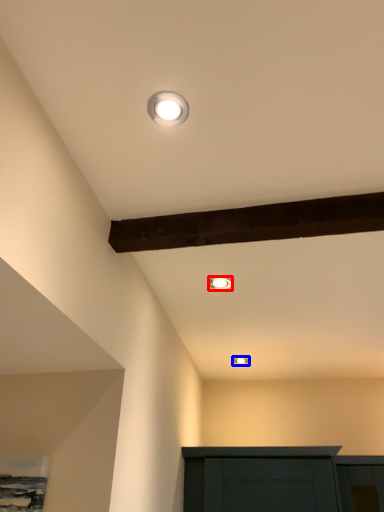
Question: Which object is further to the camera taking this photo, lamp (highlighted by a red box) or lamp (highlighted by a blue box)?

Choices:
 (A) lamp
 (B) lamp

Answer: (B)